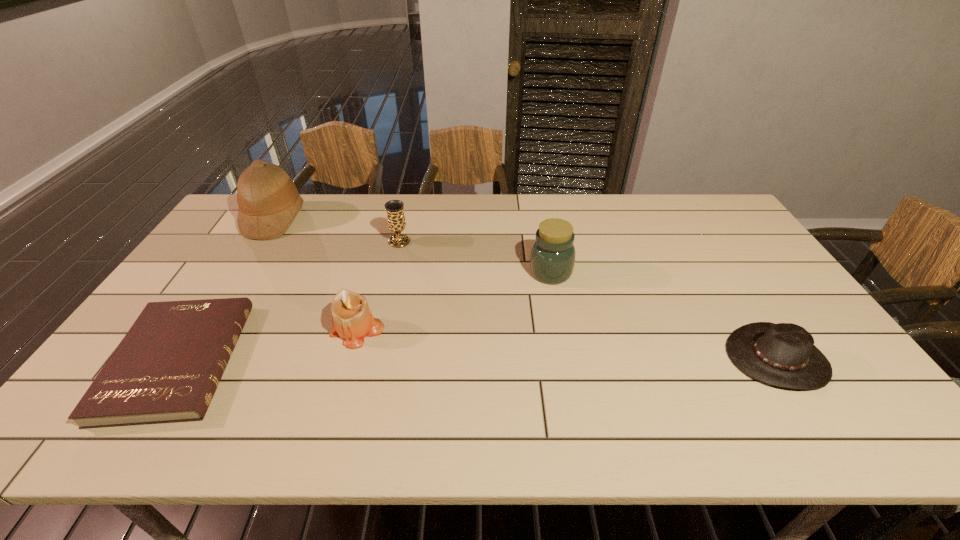
I want to click on vacant position in the image that satisfies the following two spatial constraints: 1. on the front side of the fourth nearest object; 2. on the left side of the chalice, so click(393, 272).

You are a GUI agent. You are given a task and a screenshot of the screen. Output one action in this format:
    pyautogui.click(x=<x>, y=<y>)
    Task: Click on the free location that satisfies the following two spatial constraints: 1. on the back side of the hardback book; 2. on the right side of the candle
    Image resolution: width=960 pixels, height=540 pixels.
    Given the screenshot: What is the action you would take?
    pyautogui.click(x=197, y=332)